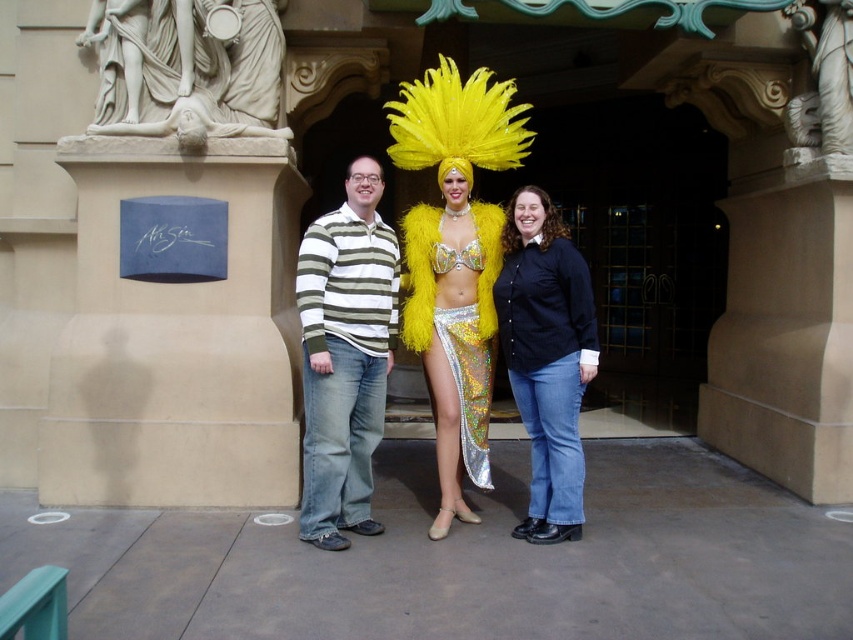
Question: Which object appears closest to the camera in this image?

Choices:
 (A) striped cotton sweater at center
 (B) shiny metallic skirt at center
 (C) shiny sequined skirt at center
 (D) black button-up shirt at center

Answer: (A)

Question: Can you confirm if shiny metallic skirt at center is positioned to the left of white marble statue at upper right?

Choices:
 (A) yes
 (B) no

Answer: (A)

Question: Considering the real-world distances, which object is farthest from the shiny metallic skirt at center?

Choices:
 (A) white marble statue at upper left
 (B) black button-up shirt at center

Answer: (A)

Question: Is the position of black button-up shirt at center less distant than that of white marble statue at upper right?

Choices:
 (A) yes
 (B) no

Answer: (A)

Question: Can you confirm if white marble statue at upper left is thinner than white marble statue at upper right?

Choices:
 (A) yes
 (B) no

Answer: (B)

Question: Which object is closer to the camera taking this photo?

Choices:
 (A) white marble statue at upper left
 (B) black button-up shirt at center
 (C) shiny metallic skirt at center
 (D) white marble statue at upper right

Answer: (C)